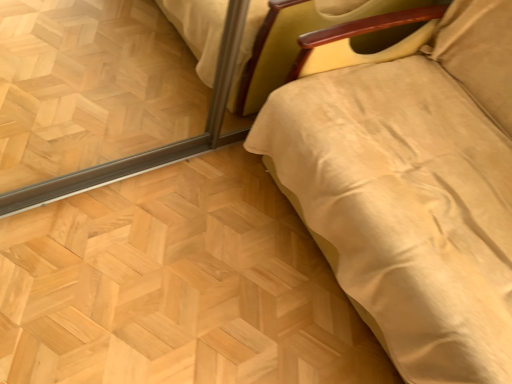
Question: From the image's perspective, does natural wood floor at lower right appear lower than beige fabric bed at right?

Choices:
 (A) no
 (B) yes

Answer: (B)

Question: Would you say beige fabric bed at right is part of natural wood floor at lower right's contents?

Choices:
 (A) yes
 (B) no

Answer: (B)

Question: Is natural wood floor at lower right smaller than beige fabric bed at right?

Choices:
 (A) no
 (B) yes

Answer: (B)

Question: Does natural wood floor at lower right have a greater width compared to beige fabric bed at right?

Choices:
 (A) yes
 (B) no

Answer: (B)

Question: Is natural wood floor at lower right turned away from beige fabric bed at right?

Choices:
 (A) no
 (B) yes

Answer: (A)

Question: Is natural wood floor at lower right far from beige fabric bed at right?

Choices:
 (A) no
 (B) yes

Answer: (A)

Question: Does beige fabric bed at right come in front of natural wood floor at lower right?

Choices:
 (A) yes
 (B) no

Answer: (A)

Question: From a real-world perspective, is beige fabric bed at right located beneath natural wood floor at lower right?

Choices:
 (A) yes
 (B) no

Answer: (B)

Question: Is beige fabric bed at right bigger than natural wood floor at lower right?

Choices:
 (A) no
 (B) yes

Answer: (B)

Question: Is beige fabric bed at right oriented towards natural wood floor at lower right?

Choices:
 (A) no
 (B) yes

Answer: (B)

Question: From the image's perspective, does beige fabric bed at right appear higher than natural wood floor at lower right?

Choices:
 (A) no
 (B) yes

Answer: (B)

Question: Can you confirm if beige fabric bed at right is smaller than natural wood floor at lower right?

Choices:
 (A) yes
 (B) no

Answer: (B)

Question: Is point (247, 345) closer or farther from the camera than point (358, 72)?

Choices:
 (A) farther
 (B) closer

Answer: (B)